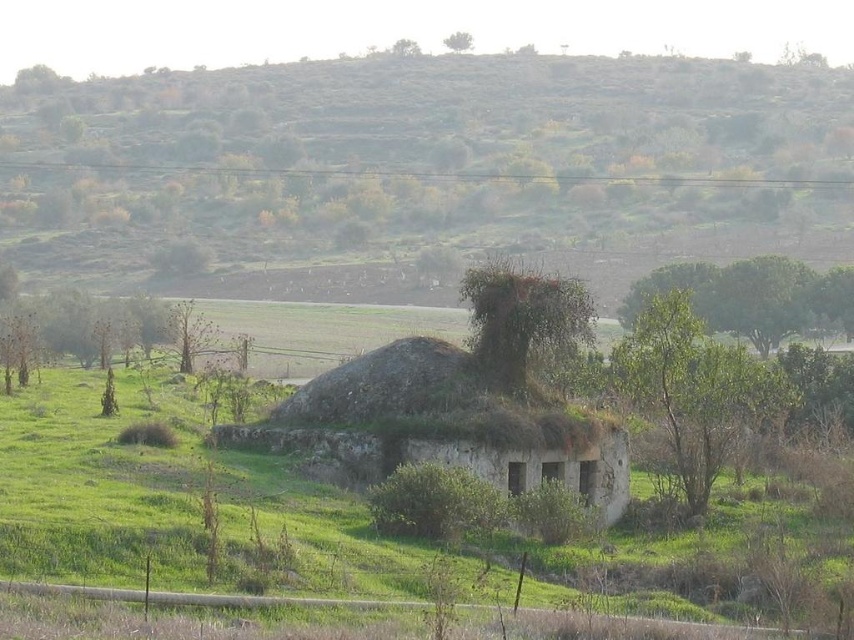
You are standing in the field and want to walk towards the green grassy at center. Which direction should you move relative to the green grassy hillside at upper center?

You should move away from the green grassy hillside at upper center because the green grassy at center is closer to you than the hillside.

You are standing at the base of the green grassy hillside at upper center. Which direction should you walk to reach the old, partially overgrown structure in the grassy field?

The green grassy hillside at upper center is located at point (422,172). Since the structure is in the grassy field, you should walk downward from the hillside to reach it.

You are a hiker trying to navigate through the green grassy hillside at upper center and the green grassy at center. Which area would allow you to walk more comfortably?

The green grassy at center would allow you to walk more comfortably because the grass there is shorter and well maintained, unlike the taller, wilder vegetation on the green grassy hillside at upper center.